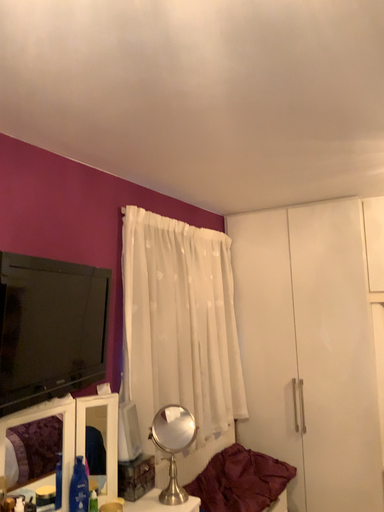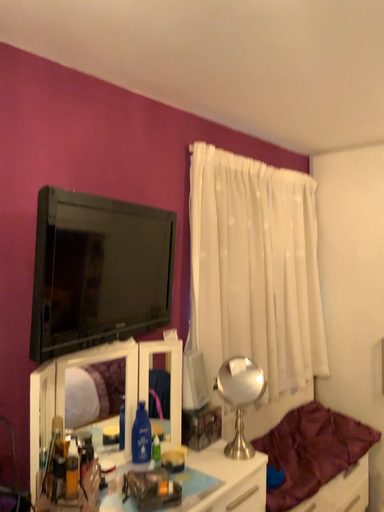
Question: How did the camera likely rotate when shooting the video?

Choices:
 (A) rotated upward
 (B) rotated downward

Answer: (B)